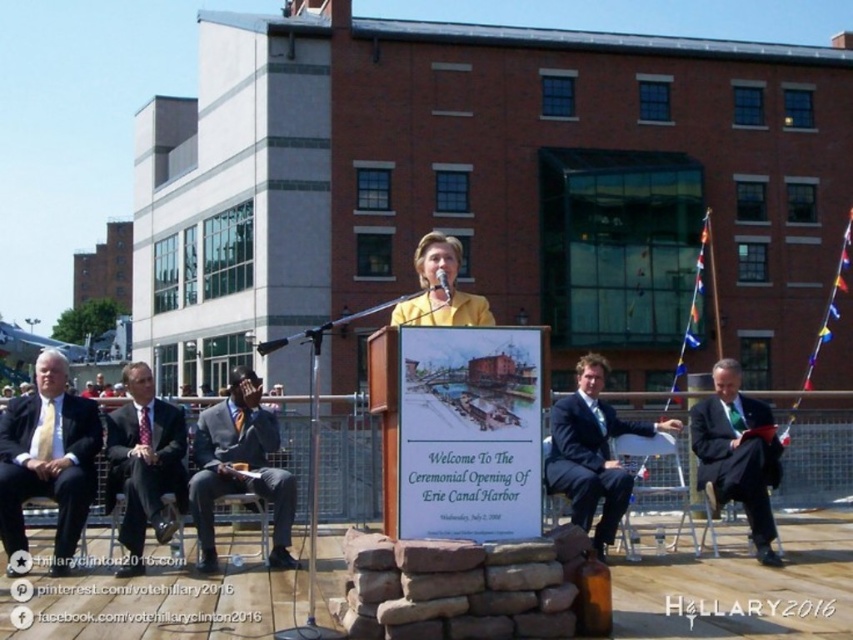
Question: From the image, what is the correct spatial relationship of matte gold tie at left in relation to dark suit at center?

Choices:
 (A) above
 (B) below

Answer: (B)

Question: Does matte black suit at center have a smaller size compared to dark suit at center?

Choices:
 (A) yes
 (B) no

Answer: (B)

Question: Can you confirm if matte gold tie at left is positioned below dark suit at center?

Choices:
 (A) yes
 (B) no

Answer: (A)

Question: Which of the following is the closest to the observer?

Choices:
 (A) yellow matte jacket at center
 (B) dark gray suit at left

Answer: (A)

Question: Among these points, which one is nearest to the camera?

Choices:
 (A) (115, 416)
 (B) (460, 307)
 (C) (567, 420)

Answer: (B)

Question: Which object appears closest to the camera in this image?

Choices:
 (A) dark gray suit at left
 (B) dark blue suit at center

Answer: (B)